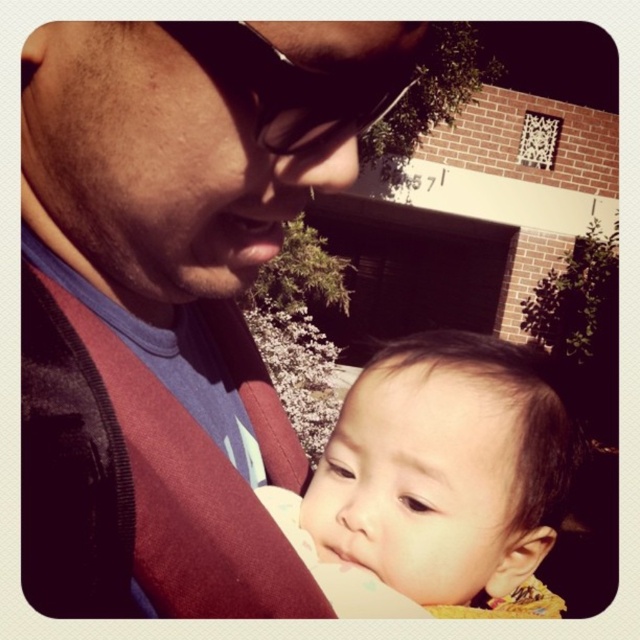
This screenshot has width=640, height=640. I want to click on matte blue shirt at center, so [172, 300].

Between matte blue shirt at center and smooth skin baby at center, which one appears on the right side from the viewer's perspective?

smooth skin baby at center is more to the right.

Where is `matte blue shirt at center`? Image resolution: width=640 pixels, height=640 pixels. matte blue shirt at center is located at coordinates (172, 300).

Locate an element on the screen. This screenshot has height=640, width=640. matte blue shirt at center is located at coordinates (172, 300).